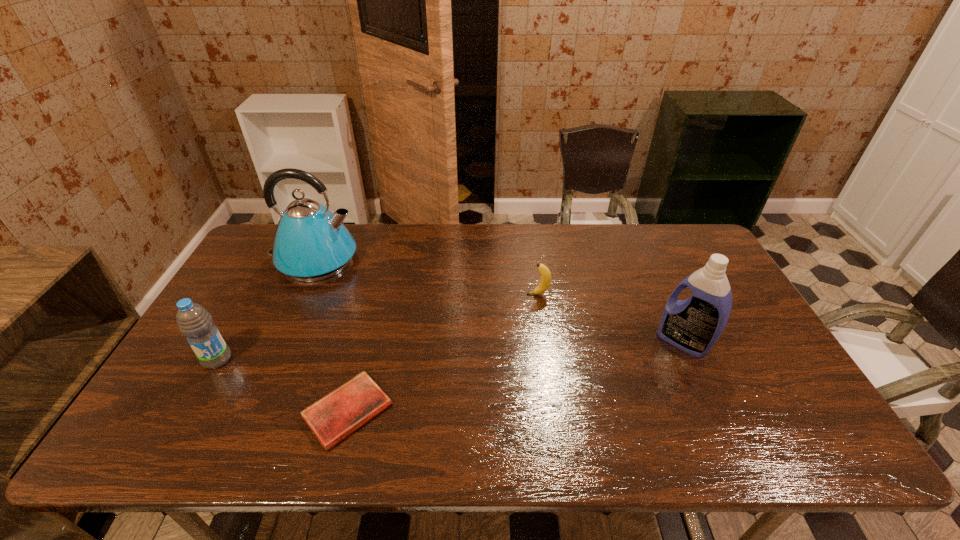
Where is `vacant space located from the stem of the banana`? This screenshot has width=960, height=540. vacant space located from the stem of the banana is located at coordinates coord(436,294).

Where is `vacant area located 0.370m from the stem of the banana`? The width and height of the screenshot is (960, 540). vacant area located 0.370m from the stem of the banana is located at coordinates (407, 294).

Identify the location of free spot located from the stem of the banana. The width and height of the screenshot is (960, 540). (449, 294).

Where is `vacant space located 0.380m on the right of the shortest object`? vacant space located 0.380m on the right of the shortest object is located at coordinates tap(551, 411).

Where is `object located in the far edge section of the desktop`? This screenshot has height=540, width=960. object located in the far edge section of the desktop is located at coordinates (311, 243).

At what (x,y) coordinates should I click in order to perform the action: click on object at the near edge. Please return your answer as a coordinate pair (x, y). Looking at the image, I should click on (335, 416).

Identify the location of kettle that is at the left edge. Image resolution: width=960 pixels, height=540 pixels. (311, 243).

Where is `water bottle positioned at the left edge`? water bottle positioned at the left edge is located at coordinates [x=194, y=322].

The height and width of the screenshot is (540, 960). I want to click on object at the right edge, so click(693, 325).

Find the location of a particular element. This screenshot has height=540, width=960. object present at the far left corner is located at coordinates (311, 243).